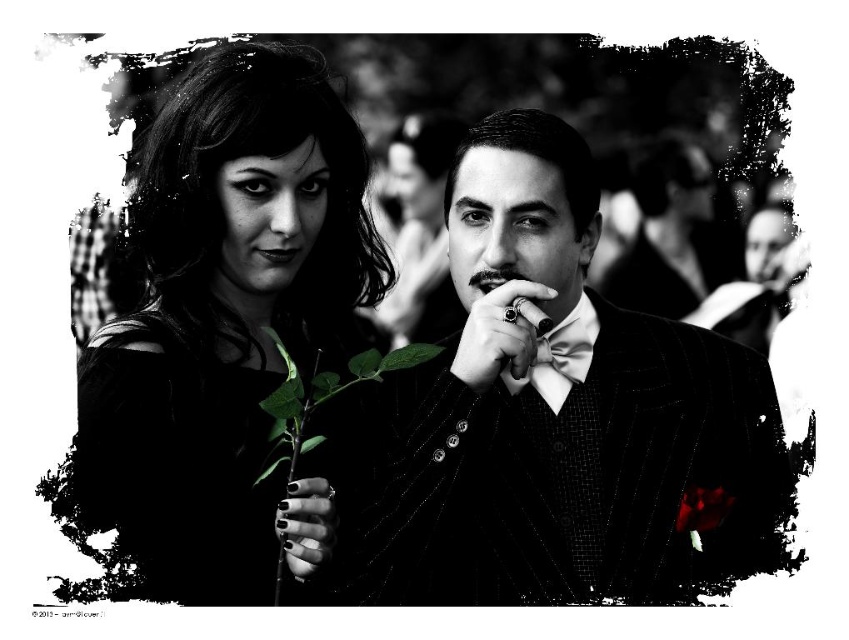
Question: Observing the image, what is the correct spatial positioning of textured pinstripe suit at center in reference to green leafy plant at lower left?

Choices:
 (A) right
 (B) left

Answer: (A)

Question: Is matte black dress at left smaller than black polished ring at center?

Choices:
 (A) no
 (B) yes

Answer: (A)

Question: Among these objects, which one is farthest from the camera?

Choices:
 (A) black matte nails at center
 (B) green leafy plant at lower left
 (C) black polished ring at center

Answer: (B)

Question: Which point appears closest to the camera in this image?

Choices:
 (A) (499, 284)
 (B) (121, 579)

Answer: (B)

Question: Considering the real-world distances, which object is closest to the matte black dress at left?

Choices:
 (A) green leafy plant at lower left
 (B) textured pinstripe suit at center

Answer: (A)

Question: Is textured pinstripe suit at center above black polished ring at center?

Choices:
 (A) yes
 (B) no

Answer: (B)